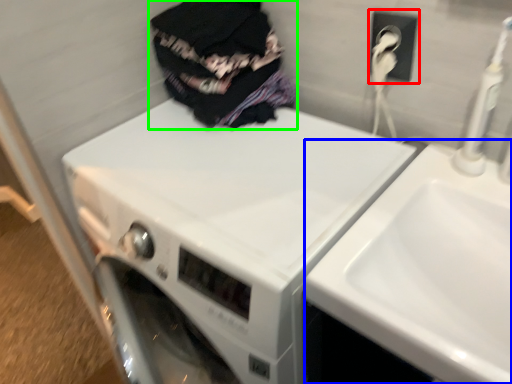
Question: Which is farther away from electric outlet (highlighted by a red box)? sink (highlighted by a blue box) or clothing (highlighted by a green box)?

Choices:
 (A) sink
 (B) clothing

Answer: (A)